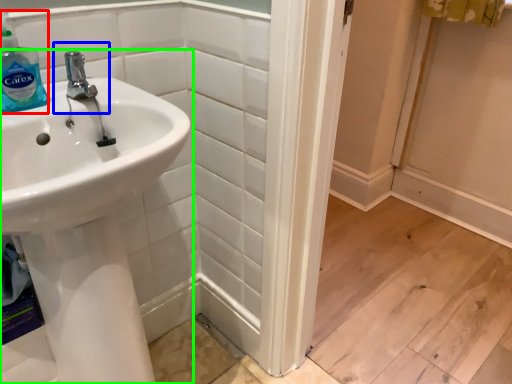
Question: Which is farther away from cleaning product (highlighted by a red box)? plumbing fixture (highlighted by a blue box) or sink (highlighted by a green box)?

Choices:
 (A) plumbing fixture
 (B) sink

Answer: (B)